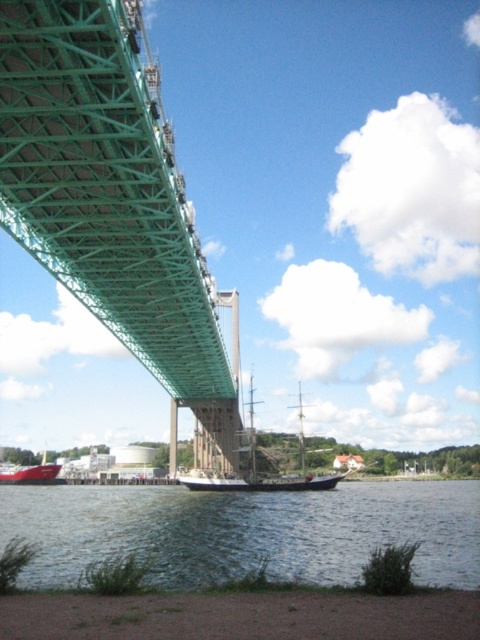
You are a photographer trying to capture the green metallic suspension bridge at upper left and the matte red boat at lower left in the same frame. Which object should you focus on first if you want to ensure both are in sharp focus, considering their sizes in the image?

The green metallic suspension bridge at upper left is thinner than the matte red boat at lower left, so you should focus on the matte red boat at lower left first because larger objects generally require more precise focus to maintain sharpness throughout the entire frame.

You are a drone operator trying to capture aerial footage of the green metallic suspension bridge at upper left. Your drone is currently at the center of the image. Which direction should you move the drone to reach the bridge?

The green metallic suspension bridge at upper left is located at point (x=113, y=202), so you should move the drone to the left and slightly downward from the center to reach it.

You are a photographer planning to take a photo of the green metallic suspension bridge at upper left and the matte red boat at lower left. Based on their positions, which object would appear closer to the bottom of the photo?

The matte red boat at lower left appears closer to the bottom of the photo because it is positioned below the green metallic suspension bridge at upper left.